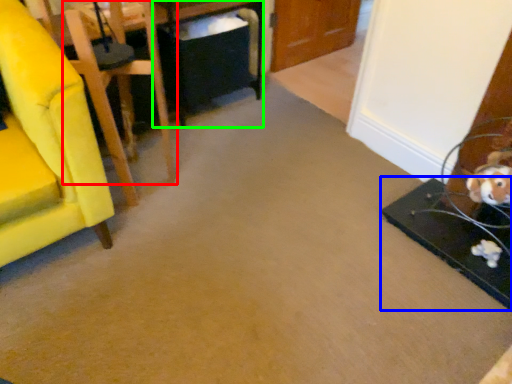
Question: Estimate the real-world distances between objects in this image. Which object is closer to chair (highlighted by a red box), table (highlighted by a blue box) or table (highlighted by a green box)?

Choices:
 (A) table
 (B) table

Answer: (B)